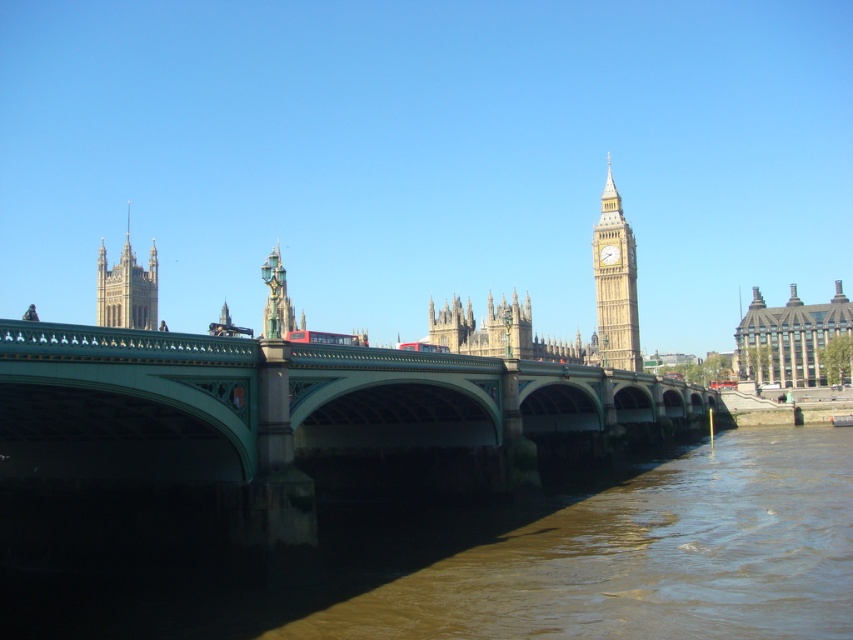
Who is taller, brown sedimentary water at lower left or golden stone tower at upper center?

With more height is golden stone tower at upper center.

Is brown sedimentary water at lower left thinner than golden stone tower at upper center?

Incorrect, brown sedimentary water at lower left's width is not less than golden stone tower at upper center's.

Is point (790, 579) positioned behind point (120, 296)?

No, it is in front of (120, 296).

This screenshot has width=853, height=640. What are the coordinates of `brown sedimentary water at lower left` in the screenshot? It's located at (544, 563).

Consider the image. Does brown sedimentary water at lower left have a smaller size compared to red metallic bus at center?

No.

Between point (51, 589) and point (292, 339), which one is positioned in front?

Point (51, 589) is more forward.

Is point (250, 595) closer to camera compared to point (351, 340)?

That is True.

Locate an element on the screen. Image resolution: width=853 pixels, height=640 pixels. brown sedimentary water at lower left is located at coordinates (544, 563).

Is green stone bridge at center wider than red metallic bus at center?

Yes.

Describe the element at coordinates (296, 404) in the screenshot. Image resolution: width=853 pixels, height=640 pixels. I see `green stone bridge at center` at that location.

Identify the location of green stone bridge at center. (296, 404).